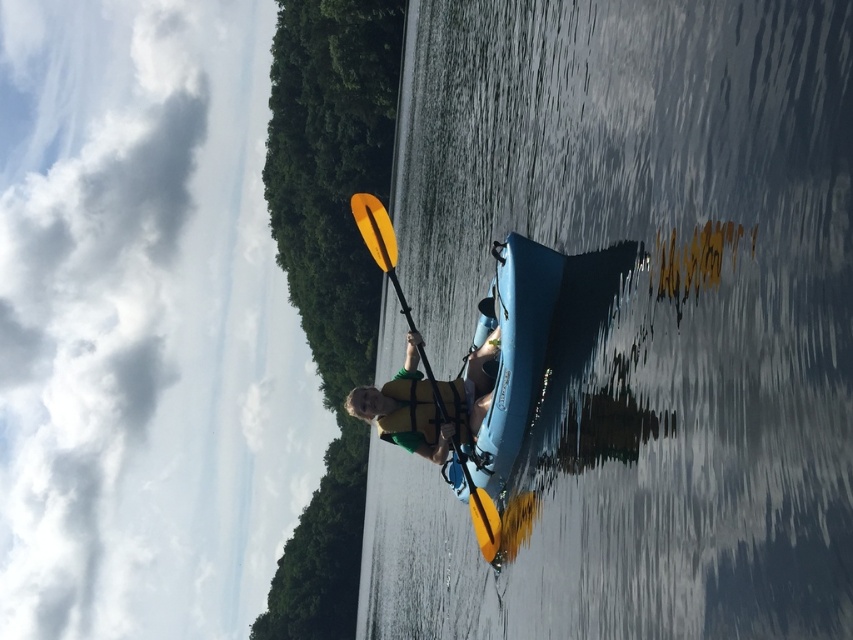
Question: Can you confirm if clear blue water at center is positioned above yellow life vest at center?

Choices:
 (A) yes
 (B) no

Answer: (A)

Question: Which object is positioned farthest from the green/yellow fabric life jacket at center?

Choices:
 (A) clear blue water at center
 (B) yellow matte paddle at center

Answer: (A)

Question: Does yellow life vest at center appear on the left side of yellow matte paddle at center?

Choices:
 (A) no
 (B) yes

Answer: (A)

Question: Among these points, which one is nearest to the camera?

Choices:
 (A) (502, 161)
 (B) (439, 424)
 (C) (397, 429)

Answer: (B)

Question: Is clear blue water at center closer to camera compared to yellow life vest at center?

Choices:
 (A) yes
 (B) no

Answer: (A)

Question: Which point is closer to the camera?

Choices:
 (A) (436, 458)
 (B) (434, 419)
 (C) (490, 556)

Answer: (C)